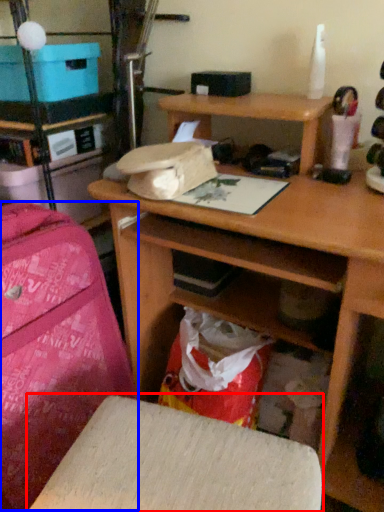
Question: Which point is closer to the camera, furniture (highlighted by a red box) or luggage (highlighted by a blue box)?

Choices:
 (A) furniture
 (B) luggage

Answer: (A)